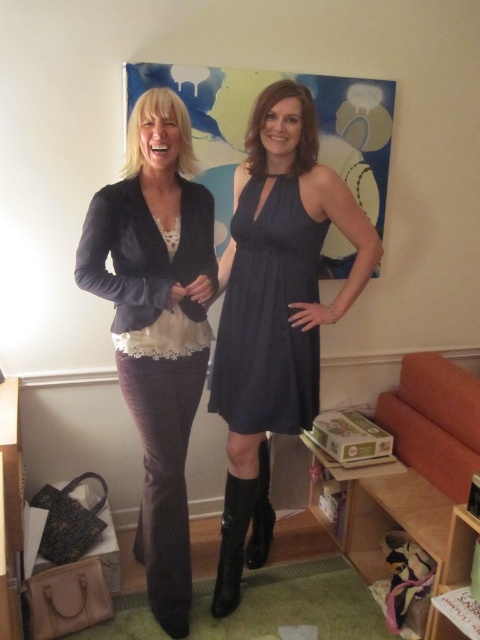
You are a photographer setting up for a shoot. You need to ensure that the dark blue textured dress at center and the black leather boot at lower center are both in focus. Given that your camera can only focus on objects within 20 inches of each other, will you need to adjust the focus settings?

The distance between the dark blue textured dress at center and the black leather boot at lower center is 22.56 inches. Since this exceeds the 20 inch focus range, you will need to adjust the focus settings.

Where is the denim dress at center located in the image?

The denim dress at center is located at point coordinates of [276,300].

You are a fashion designer who needs to create a new outfit that combines elements from the denim dress at center and the black leather boot at lower center. Given the spatial relationship between their widths, which item should you prioritize in terms of size when designing the outfit?

The denim dress at center has a larger width than the black leather boot at lower center, so you should prioritize the denim dress at center in terms of size when designing the outfit to maintain proportion and balance.